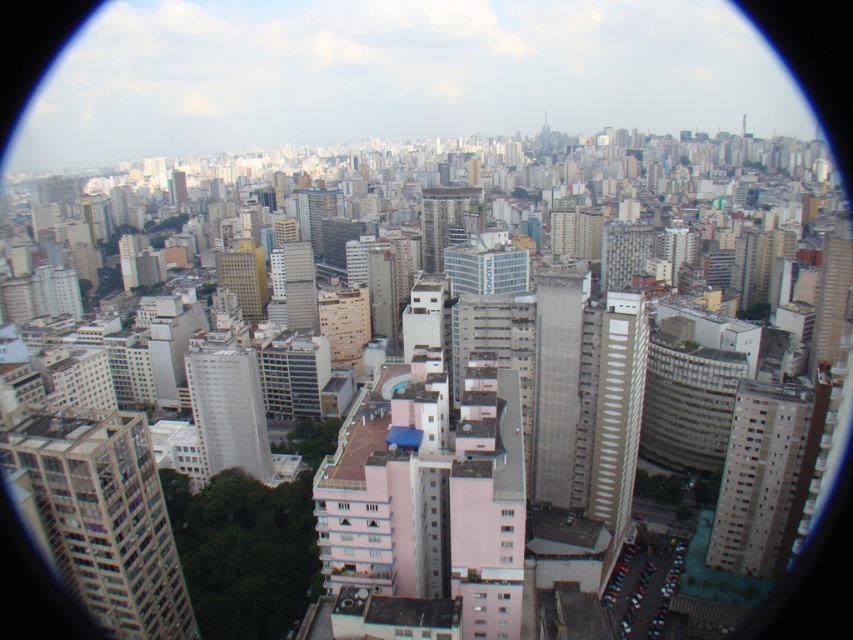
Question: Is white glass building at lower left to the right of gray concrete building at center-right from the viewer's perspective?

Choices:
 (A) yes
 (B) no

Answer: (B)

Question: Estimate the real-world distances between objects in this image. Which object is farther from the gray concrete building at center-right?

Choices:
 (A) light gray concrete building at center
 (B) white smooth building at center

Answer: (A)

Question: Is white glass building at lower left bigger than gray concrete building at center?

Choices:
 (A) yes
 (B) no

Answer: (A)

Question: Which point is farther from the camera taking this photo?

Choices:
 (A) (222, 369)
 (B) (432, 262)

Answer: (B)

Question: Can you confirm if white glass building at lower left is positioned above light gray concrete building at center?

Choices:
 (A) no
 (B) yes

Answer: (A)

Question: Which point is closer to the camera?

Choices:
 (A) (531, 488)
 (B) (86, 605)
 (C) (251, 412)
 (D) (753, 420)

Answer: (B)